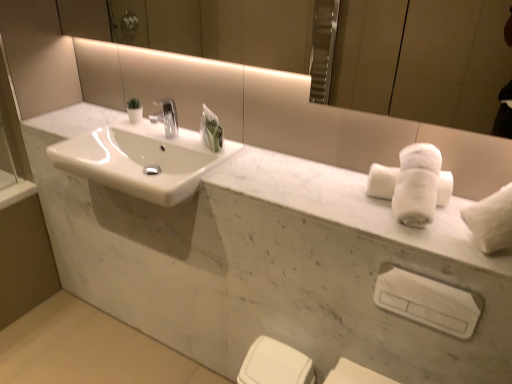
Question: Is white fluffy bath towel at right wider than smooth concrete floor at lower left?

Choices:
 (A) no
 (B) yes

Answer: (A)

Question: Is the depth of white fluffy bath towel at right less than that of smooth concrete floor at lower left?

Choices:
 (A) no
 (B) yes

Answer: (B)

Question: Does white fluffy bath towel at right have a greater height compared to smooth concrete floor at lower left?

Choices:
 (A) no
 (B) yes

Answer: (B)

Question: Is white fluffy bath towel at right oriented away from smooth concrete floor at lower left?

Choices:
 (A) no
 (B) yes

Answer: (A)

Question: From the image's perspective, is white fluffy bath towel at right above smooth concrete floor at lower left?

Choices:
 (A) yes
 (B) no

Answer: (A)

Question: From a real-world perspective, is white fluffy bath towel at right positioned under smooth concrete floor at lower left based on gravity?

Choices:
 (A) no
 (B) yes

Answer: (A)

Question: Is white plastic towel bar at lower right at the right side of white marble sink at center, the 2th porcelain when ordered from bottom to top?

Choices:
 (A) yes
 (B) no

Answer: (A)

Question: From the image's perspective, is white plastic towel bar at lower right under white marble sink at center, the 2th porcelain when ordered from bottom to top?

Choices:
 (A) yes
 (B) no

Answer: (A)

Question: From the image's perspective, is white plastic towel bar at lower right on white marble sink at center, the 2th porcelain when ordered from bottom to top?

Choices:
 (A) no
 (B) yes

Answer: (A)

Question: Is white plastic towel bar at lower right thinner than white marble sink at center, the 2th porcelain when ordered from bottom to top?

Choices:
 (A) no
 (B) yes

Answer: (B)

Question: Is white plastic towel bar at lower right positioned in front of white marble sink at center, the 2th porcelain when ordered from bottom to top?

Choices:
 (A) no
 (B) yes

Answer: (A)

Question: Would you say white plastic towel bar at lower right contains white marble sink at center, the 2th porcelain when ordered from bottom to top?

Choices:
 (A) yes
 (B) no

Answer: (B)

Question: Considering the relative sizes of white marble sink at center and white fluffy bath towel at right in the image provided, is white marble sink at center thinner than white fluffy bath towel at right?

Choices:
 (A) yes
 (B) no

Answer: (B)